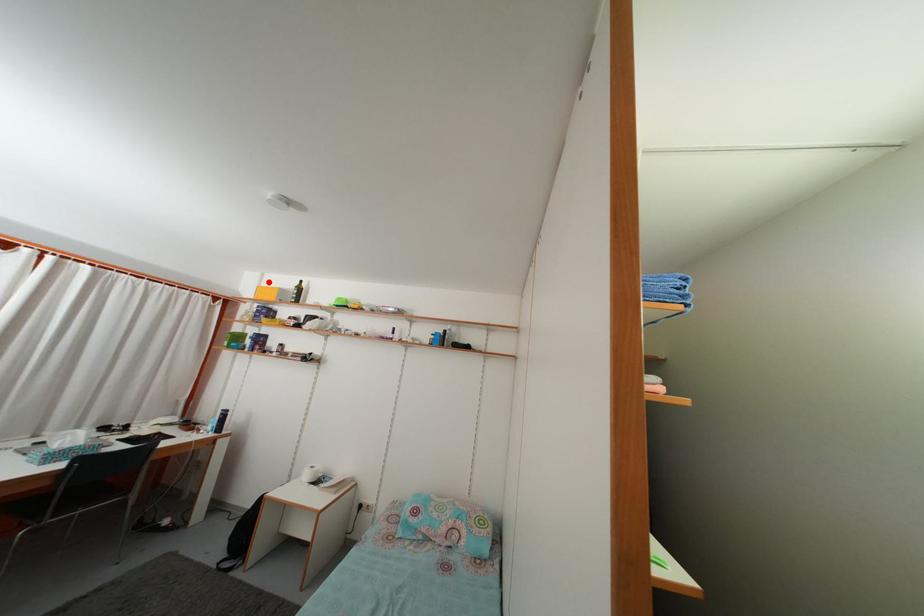
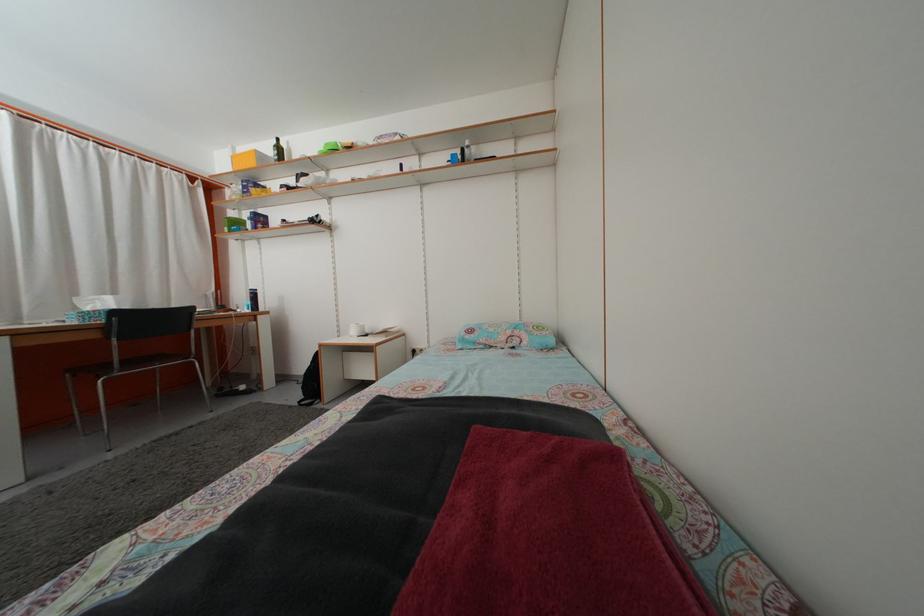
Locate, in the second image, the point that corresponds to the highlighted location in the first image.

(239, 156)